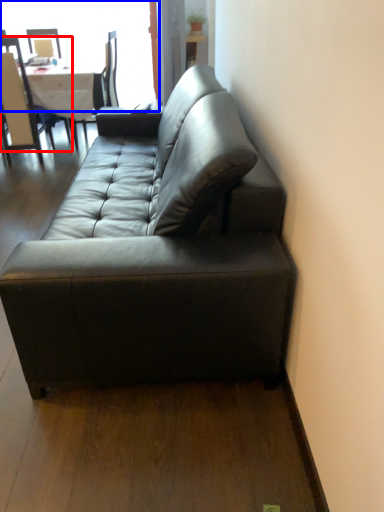
Question: Which point is further to the camera, chair (highlighted by a red box) or window (highlighted by a blue box)?

Choices:
 (A) chair
 (B) window

Answer: (B)